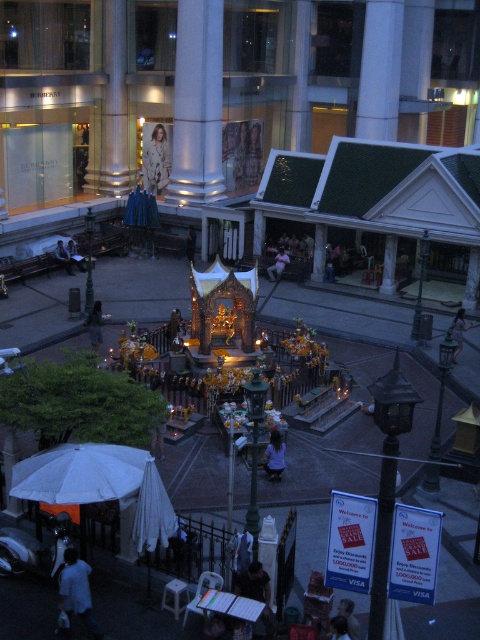
Question: Is smooth skin face at center in front of light beige fabric at center?

Choices:
 (A) no
 (B) yes

Answer: (B)

Question: Can you confirm if light gray fabric bag at lower left is bigger than dark brown leather jacket at center?

Choices:
 (A) no
 (B) yes

Answer: (B)

Question: Which of the following is the farthest from the observer?

Choices:
 (A) (278, 477)
 (B) (264, 593)
 (C) (70, 257)

Answer: (C)

Question: Estimate the real-world distances between objects in this image. Which object is closer to the light brown fabric at center?

Choices:
 (A) dark blue shirt at center
 (B) light beige fabric at center
 (C) light brown wooden bench at center

Answer: (C)

Question: Which point is farther to the camera?

Choices:
 (A) dark blue shirt at center
 (B) smooth skin face at center
 (C) light brown fabric at center
 (D) dark brown leather jacket at center

Answer: (C)

Question: Is tan suede coat at center positioned in front of light beige fabric at center?

Choices:
 (A) yes
 (B) no

Answer: (B)